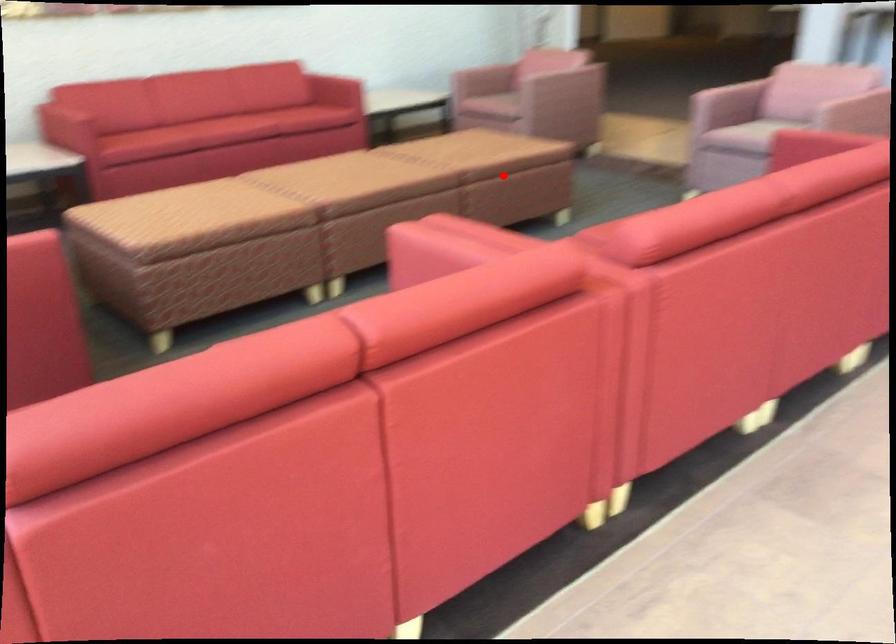
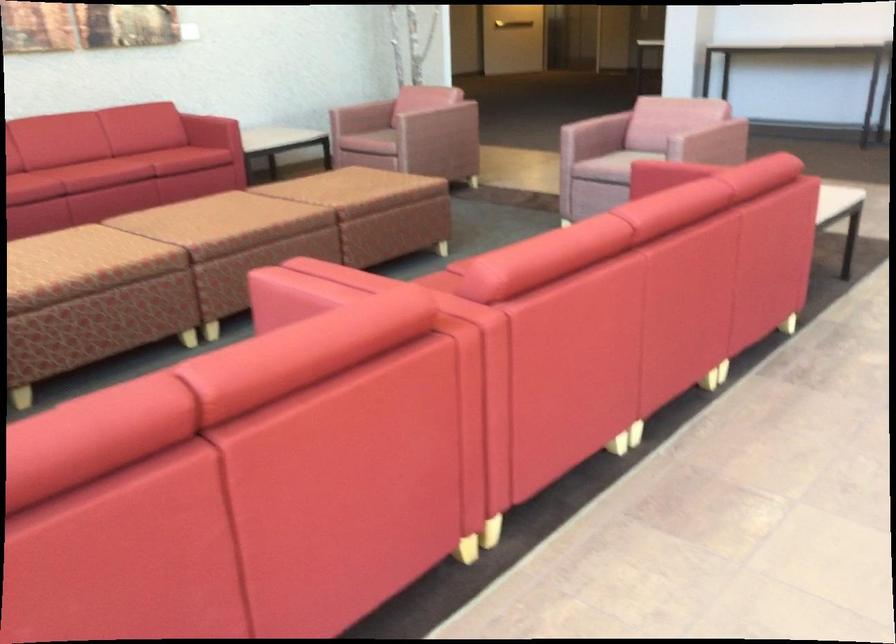
Find the pixel in the second image that matches the highlighted location in the first image.

(380, 212)